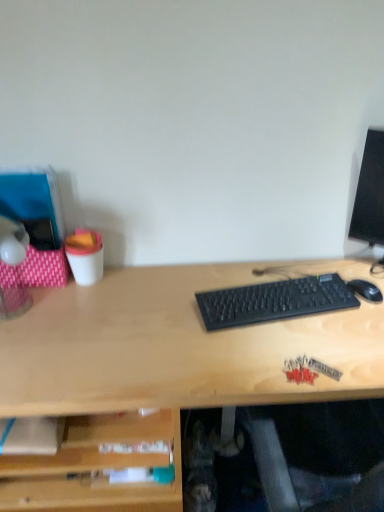
This screenshot has width=384, height=512. In order to click on black plastic keyboard at center in this screenshot , I will do `click(274, 301)`.

At what (x,y) coordinates should I click in order to perform the action: click on translucent plastic lamp at left. Please return your answer as a coordinate pair (x, y). The width and height of the screenshot is (384, 512). Looking at the image, I should click on (12, 242).

Find the location of a particular element. black plastic keyboard at center is located at coordinates (274, 301).

At what (x,y) coordinates should I click in order to perform the action: click on computer keyboard that appears below the translucent plastic lamp at left (from a real-world perspective). Please return your answer as a coordinate pair (x, y). This screenshot has height=512, width=384. Looking at the image, I should click on (274, 301).

Between black plastic keyboard at center and translucent plastic lamp at left, which one has smaller size?

With smaller size is black plastic keyboard at center.

Is black plastic keyboard at center facing away from translucent plastic lamp at left?

black plastic keyboard at center is not turned away from translucent plastic lamp at left.

From the image's perspective, which is above, translucent plastic lamp at left or black plastic keyboard at center?

From the image's view, translucent plastic lamp at left is above.

Which is closer, (x=0, y=316) or (x=273, y=293)?

Point (x=0, y=316).

Considering the sizes of objects translucent plastic lamp at left and black plastic keyboard at center in the image provided, who is taller, translucent plastic lamp at left or black plastic keyboard at center?

translucent plastic lamp at left.

Could black matte mouse at right be considered to be inside black plastic keyboard at center?

No, black matte mouse at right is not inside black plastic keyboard at center.

Is black plastic keyboard at center to the left of black matte mouse at right from the viewer's perspective?

Correct, you'll find black plastic keyboard at center to the left of black matte mouse at right.

Is black plastic keyboard at center aimed at black matte mouse at right?

No.

Locate an element on the screen. mouse lying on the right of translucent plastic lamp at left is located at coordinates (366, 290).

Which object is positioned more to the left, black matte mouse at right or translucent plastic lamp at left?

translucent plastic lamp at left is more to the left.

Do you think black matte mouse at right is within translucent plastic lamp at left, or outside of it?

black matte mouse at right is not enclosed by translucent plastic lamp at left.

Is black matte mouse at right positioned far away from translucent plastic lamp at left?

Yes, black matte mouse at right and translucent plastic lamp at left are located far from each other.

Are translucent plastic lamp at left and black matte mouse at right beside each other?

No.

Is translucent plastic lamp at left located outside black matte mouse at right?

Indeed, translucent plastic lamp at left is completely outside black matte mouse at right.

Find the location of a particular element. Image resolution: width=384 pixels, height=512 pixels. table lamp in front of the black matte mouse at right is located at coordinates (12, 242).

From a real-world perspective, does black matte mouse at right stand above black plastic keyboard at center?

No, from a real-world perspective, black matte mouse at right is not above black plastic keyboard at center.

Considering the positions of objects black matte mouse at right and black plastic keyboard at center in the image provided, who is behind, black matte mouse at right or black plastic keyboard at center?

black matte mouse at right is behind.

From the image's perspective, is black matte mouse at right over black plastic keyboard at center?

Yes, from the image's perspective, black matte mouse at right is on top of black plastic keyboard at center.

Is black matte mouse at right turned away from black plastic keyboard at center?

No, black matte mouse at right's orientation is not away from black plastic keyboard at center.

At what (x,y) coordinates should I click in order to perform the action: click on computer keyboard that appears below the translucent plastic lamp at left (from a real-world perspective). Please return your answer as a coordinate pair (x, y). Looking at the image, I should click on (274, 301).

Locate an element on the screen. The width and height of the screenshot is (384, 512). table lamp that appears above the black plastic keyboard at center (from the image's perspective) is located at coordinates (12, 242).

Based on the photo, when comparing their distances from black plastic keyboard at center, does translucent plastic lamp at left or black matte mouse at right seem further?

translucent plastic lamp at left lies further to black plastic keyboard at center than the other object.

In the scene shown: Considering their positions, is translucent plastic lamp at left positioned closer to black matte mouse at right than black plastic keyboard at center?

black plastic keyboard at center lies closer to black matte mouse at right than the other object.

Looking at the image, which one is located further to translucent plastic lamp at left, black matte mouse at right or black plastic keyboard at center?

Based on the image, black matte mouse at right appears to be further to translucent plastic lamp at left.

Considering their positions, is black plastic keyboard at center positioned further to translucent plastic lamp at left than black matte mouse at right?

black matte mouse at right lies further to translucent plastic lamp at left than the other object.

Which object lies nearer to the anchor point black matte mouse at right, black plastic keyboard at center or translucent plastic lamp at left?

black plastic keyboard at center lies closer to black matte mouse at right than the other object.

Looking at the image, which one is located closer to black plastic keyboard at center, black matte mouse at right or translucent plastic lamp at left?

black matte mouse at right is closer to black plastic keyboard at center.

This screenshot has height=512, width=384. What are the coordinates of `computer keyboard located between translucent plastic lamp at left and black matte mouse at right in the left-right direction` in the screenshot? It's located at (274, 301).